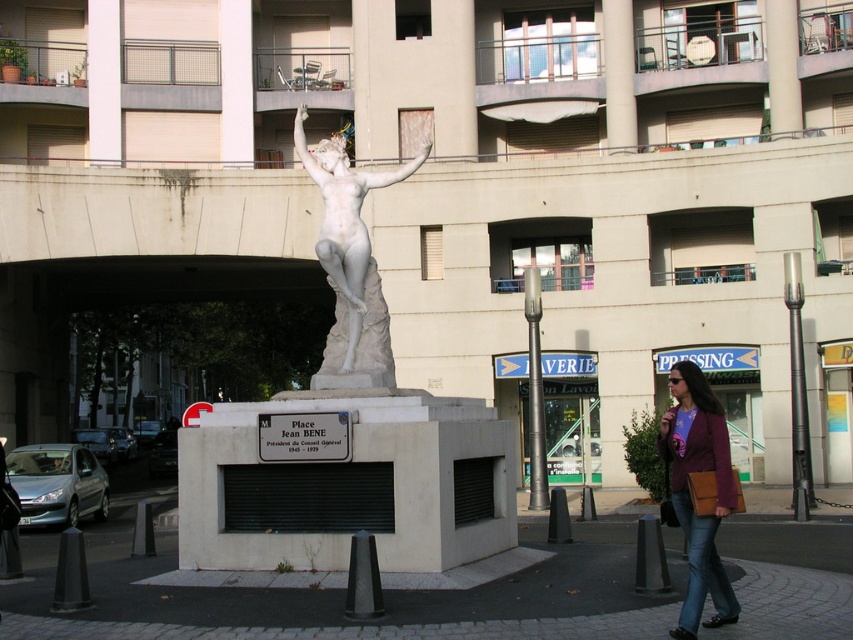
Consider the image. Who is more forward, (712, 396) or (323, 150)?

Point (712, 396)

What do you see at coordinates (689, 493) in the screenshot? I see `purple leather jacket at lower right` at bounding box center [689, 493].

Image resolution: width=853 pixels, height=640 pixels. In order to click on purple leather jacket at lower right in this screenshot , I will do `click(689, 493)`.